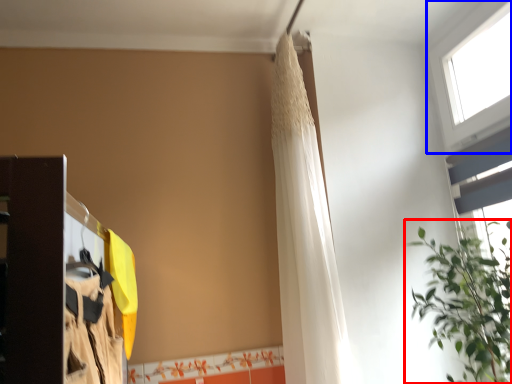
Question: Which of the following is the closest to the observer, houseplant (highlighted by a red box) or window (highlighted by a blue box)?

Choices:
 (A) houseplant
 (B) window

Answer: (A)